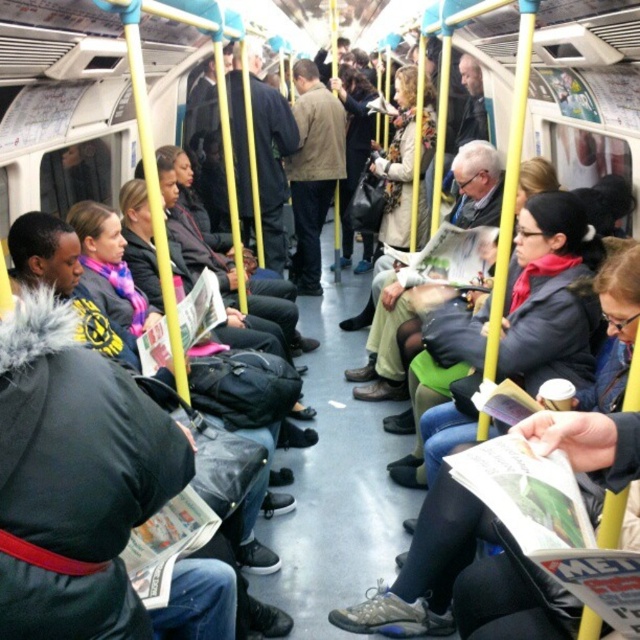
Question: In this image, where is brown leather jacket at center located relative to dark blue jacket at center?

Choices:
 (A) right
 (B) left

Answer: (A)

Question: Which of the following is the farthest from the observer?

Choices:
 (A) brown leather jacket at center
 (B) dark blue jacket at center

Answer: (A)

Question: Does brown leather jacket at center have a smaller size compared to dark blue jacket at center?

Choices:
 (A) no
 (B) yes

Answer: (A)

Question: Which of the following is the farthest from the observer?

Choices:
 (A) click(275, 195)
 (B) click(337, 122)

Answer: (B)

Question: Is brown leather jacket at center positioned behind dark blue jacket at center?

Choices:
 (A) yes
 (B) no

Answer: (A)